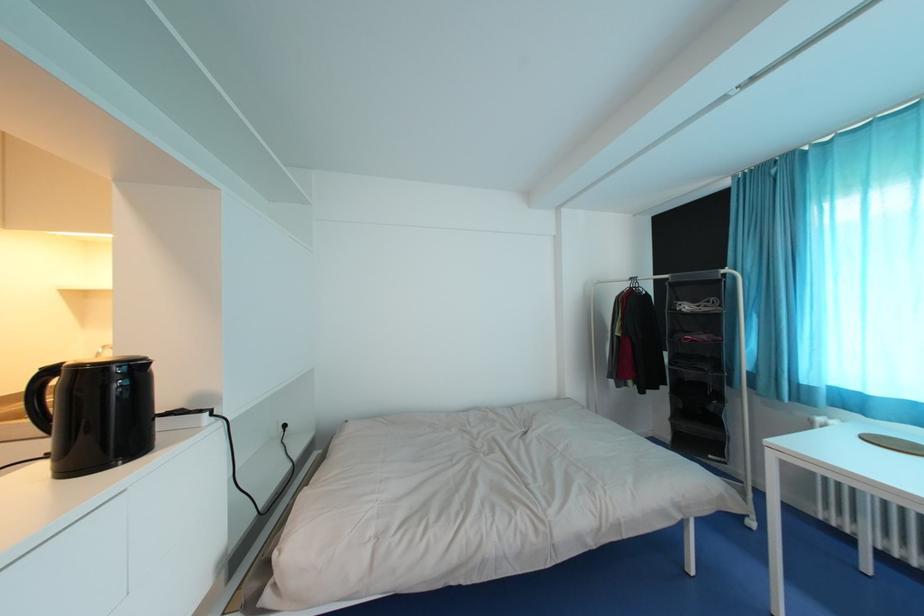
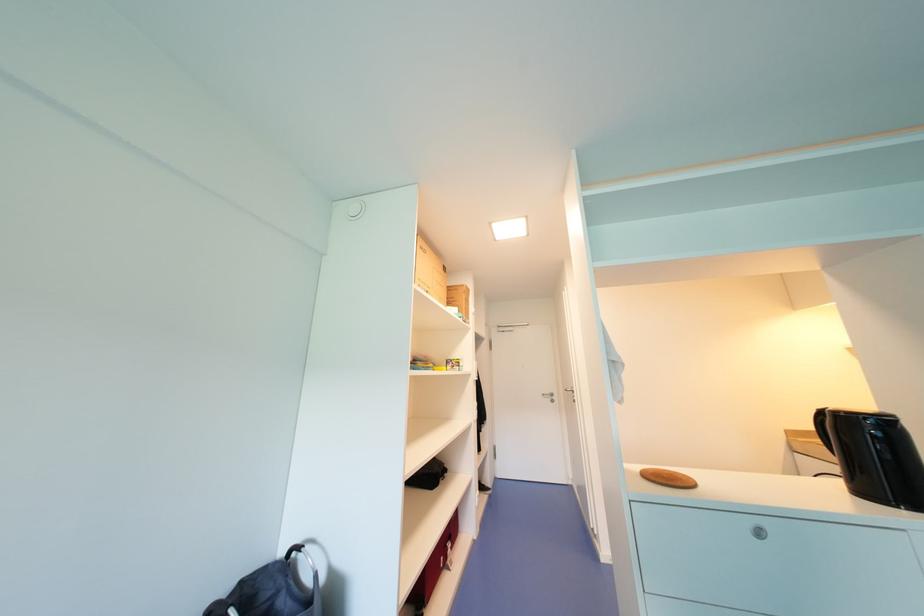
Question: The camera is either moving clockwise (left) or counter-clockwise (right) around the object. The first image is from the beginning of the video and the second image is from the end. Is the camera moving left or right when shooting the video?

Choices:
 (A) Left
 (B) Right

Answer: (B)